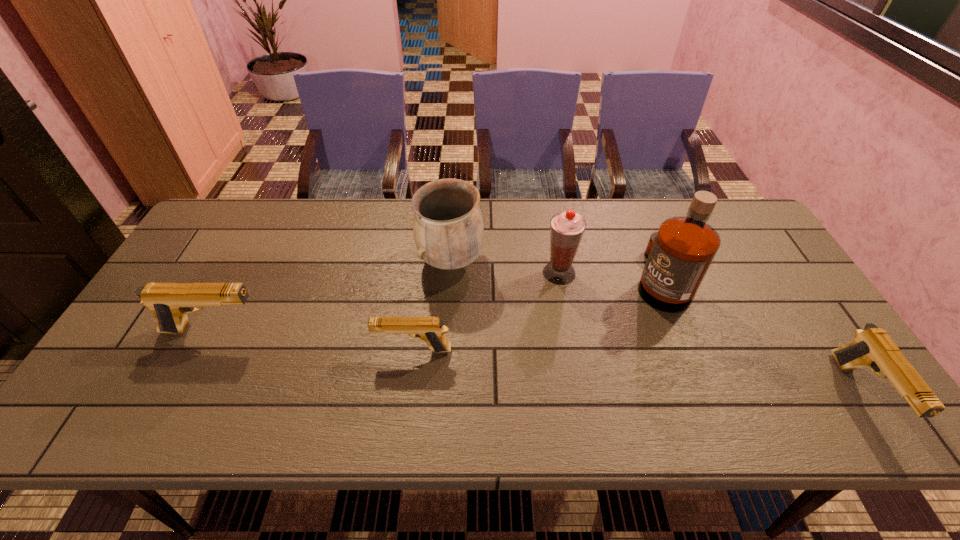
What are the coordinates of `the farthest pistol` in the screenshot? It's located at (170, 302).

The image size is (960, 540). In order to click on the leftmost object in this screenshot , I will do `click(170, 302)`.

This screenshot has width=960, height=540. I want to click on the shortest pistol, so click(431, 330).

At what (x,y) coordinates should I click in order to perform the action: click on the shortest object. Please return your answer as a coordinate pair (x, y). This screenshot has width=960, height=540. Looking at the image, I should click on (431, 330).

You are a GUI agent. You are given a task and a screenshot of the screen. Output one action in this format:
    pyautogui.click(x=<x>, y=<y>)
    Task: Click on the rightmost object
    This screenshot has height=540, width=960.
    Given the screenshot: What is the action you would take?
    pyautogui.click(x=872, y=347)

Where is `the rightmost pistol`? The height and width of the screenshot is (540, 960). the rightmost pistol is located at coordinates (872, 347).

Find the location of a particular element. the third object from right to left is located at coordinates (567, 228).

Where is `the fifth object from left to right`? The width and height of the screenshot is (960, 540). the fifth object from left to right is located at coordinates (679, 255).

The height and width of the screenshot is (540, 960). What are the coordinates of `liquor` in the screenshot? It's located at (679, 255).

This screenshot has width=960, height=540. In order to click on urn in this screenshot , I will do `click(448, 230)`.